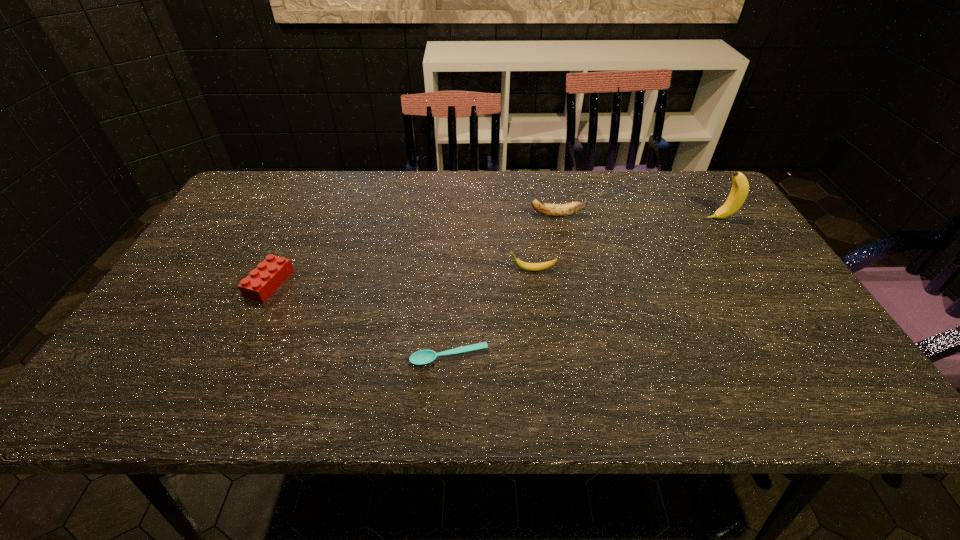
Identify the location of vacant region located from the stem of the rightmost object. (669, 219).

The height and width of the screenshot is (540, 960). What are the coordinates of `vacant space situated from the stem of the rightmost object` in the screenshot? It's located at (580, 219).

Where is `vacant space situated at the stem of the second tallest object`? The image size is (960, 540). vacant space situated at the stem of the second tallest object is located at coordinates (426, 215).

Where is `free spot located at the stem of the second tallest object`? free spot located at the stem of the second tallest object is located at coordinates (450, 215).

Find the location of `vacant space located 0.090m at the stem of the second tallest object`. vacant space located 0.090m at the stem of the second tallest object is located at coordinates (497, 215).

Locate an element on the screen. vacant space situated 0.240m at the stem of the shortest banana is located at coordinates (415, 270).

Locate an element on the screen. free space located 0.360m at the stem of the shortest banana is located at coordinates (368, 270).

Image resolution: width=960 pixels, height=540 pixels. I want to click on vacant region located 0.320m at the stem of the shortest banana, so click(384, 270).

I want to click on vacant space located 0.140m on the back of the Lego, so click(295, 232).

Identify the location of vacant region located 0.160m on the right of the fourth object from right to left. The width and height of the screenshot is (960, 540). (564, 357).